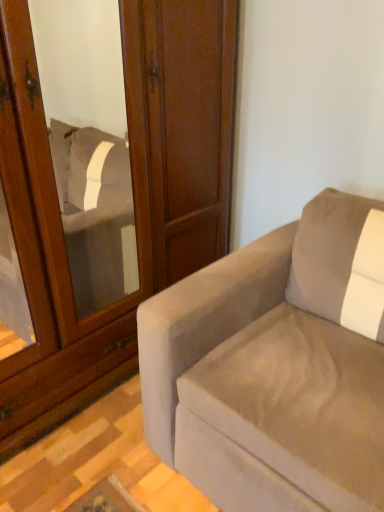
The image size is (384, 512). What do you see at coordinates (276, 366) in the screenshot? I see `suede-like beige couch at right` at bounding box center [276, 366].

What is the approximate width of suede-like beige couch at right?

suede-like beige couch at right is 1.09 meters wide.

What is the approximate height of suede-like beige couch at right?

The height of suede-like beige couch at right is 35.16 inches.

Where is `suede-like beige couch at right`? suede-like beige couch at right is located at coordinates (276, 366).

The width and height of the screenshot is (384, 512). Identify the location of matte wood screen door at upper left. (62, 247).

The width and height of the screenshot is (384, 512). Describe the element at coordinates (62, 247) in the screenshot. I see `matte wood screen door at upper left` at that location.

Identify the location of suede-like beige couch at right. (276, 366).

Which is more to the right, matte wood screen door at upper left or suede-like beige couch at right?

From the viewer's perspective, suede-like beige couch at right appears more on the right side.

Is matte wood screen door at upper left further to the viewer compared to suede-like beige couch at right?

That is True.

Considering the positions of point (31, 50) and point (143, 394), is point (31, 50) closer or farther from the camera than point (143, 394)?

Point (31, 50).

From the image's perspective, which is above, matte wood screen door at upper left or suede-like beige couch at right?

From the image's view, matte wood screen door at upper left is above.

From a real-world perspective, is matte wood screen door at upper left above or below suede-like beige couch at right?

matte wood screen door at upper left is situated higher than suede-like beige couch at right in the real world.

Can you confirm if matte wood screen door at upper left is wider than suede-like beige couch at right?

No.

Which of these two, matte wood screen door at upper left or suede-like beige couch at right, stands shorter?

With less height is suede-like beige couch at right.

In terms of size, does matte wood screen door at upper left appear bigger or smaller than suede-like beige couch at right?

Considering their sizes, matte wood screen door at upper left takes up more space than suede-like beige couch at right.

Do you think matte wood screen door at upper left is within suede-like beige couch at right, or outside of it?

matte wood screen door at upper left is spatially situated outside suede-like beige couch at right.

Looking at this image, is matte wood screen door at upper left beside suede-like beige couch at right?

There is a gap between matte wood screen door at upper left and suede-like beige couch at right.

Is matte wood screen door at upper left oriented away from suede-like beige couch at right?

matte wood screen door at upper left does not have its back to suede-like beige couch at right.

You are a GUI agent. You are given a task and a screenshot of the screen. Output one action in this format:
    pyautogui.click(x=<x>, y=<y>)
    Task: Click on the studio couch lying on the right of matte wood screen door at upper left
    
    Given the screenshot: What is the action you would take?
    pyautogui.click(x=276, y=366)

Between suede-like beige couch at right and matte wood screen door at upper left, which one appears on the right side from the viewer's perspective?

Positioned to the right is suede-like beige couch at right.

Which object is further away from the camera, suede-like beige couch at right or matte wood screen door at upper left?

matte wood screen door at upper left is behind.

Does point (172, 344) come closer to viewer compared to point (45, 334)?

Yes, point (172, 344) is closer to viewer.

From the image's perspective, which is below, suede-like beige couch at right or matte wood screen door at upper left?

suede-like beige couch at right, from the image's perspective.

From a real-world perspective, between suede-like beige couch at right and matte wood screen door at upper left, who is vertically higher?

From a 3D spatial view, matte wood screen door at upper left is above.

In terms of width, does suede-like beige couch at right look wider or thinner when compared to matte wood screen door at upper left?

In the image, suede-like beige couch at right appears to be wider than matte wood screen door at upper left.

Looking at this image, does suede-like beige couch at right have a lesser height compared to matte wood screen door at upper left?

Yes, suede-like beige couch at right is shorter than matte wood screen door at upper left.

Is suede-like beige couch at right bigger than matte wood screen door at upper left?

No, suede-like beige couch at right is not bigger than matte wood screen door at upper left.

Would you say matte wood screen door at upper left is part of suede-like beige couch at right's contents?

No, matte wood screen door at upper left is located outside of suede-like beige couch at right.

Are suede-like beige couch at right and matte wood screen door at upper left far apart?

suede-like beige couch at right is near matte wood screen door at upper left, not far away.

Does suede-like beige couch at right turn towards matte wood screen door at upper left?

No, suede-like beige couch at right is not oriented towards matte wood screen door at upper left.

What's the angular difference between suede-like beige couch at right and matte wood screen door at upper left's facing directions?

The angle between the facing direction of suede-like beige couch at right and the facing direction of matte wood screen door at upper left is 89.7 degrees.

You are a GUI agent. You are given a task and a screenshot of the screen. Output one action in this format:
    pyautogui.click(x=<x>, y=<y>)
    Task: Click on the screen door behind the suede-like beige couch at right
    The image size is (384, 512).
    Given the screenshot: What is the action you would take?
    pyautogui.click(x=62, y=247)

What are the coordinates of `studio couch in front of the matte wood screen door at upper left` in the screenshot? It's located at pyautogui.click(x=276, y=366).

Where is `screen door above the suede-like beige couch at right (from a real-world perspective)`? screen door above the suede-like beige couch at right (from a real-world perspective) is located at coordinates (62, 247).